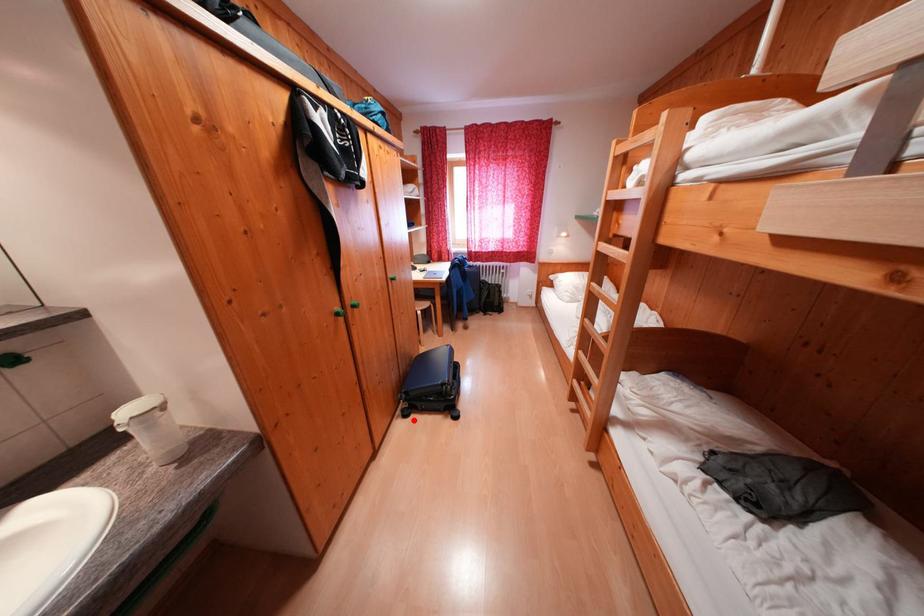
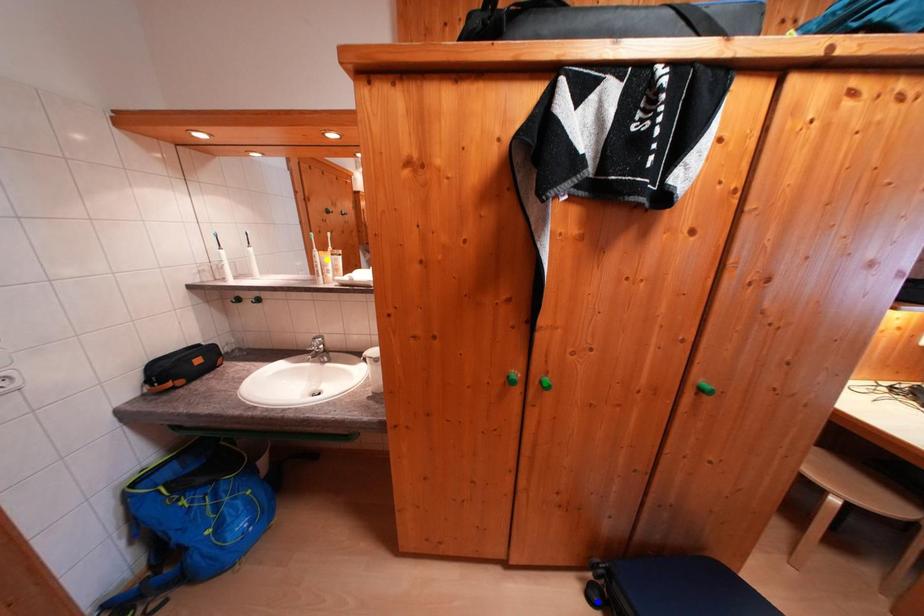
Question: I am providing you with two images of the same scene from different viewpoints. A red point is marked on the first image. You are given multiple points on the second image. Can you choose the point in image 2 that corresponds to the point in image 1?

Choices:
 (A) blue point
 (B) green point
 (C) yellow point

Answer: (A)